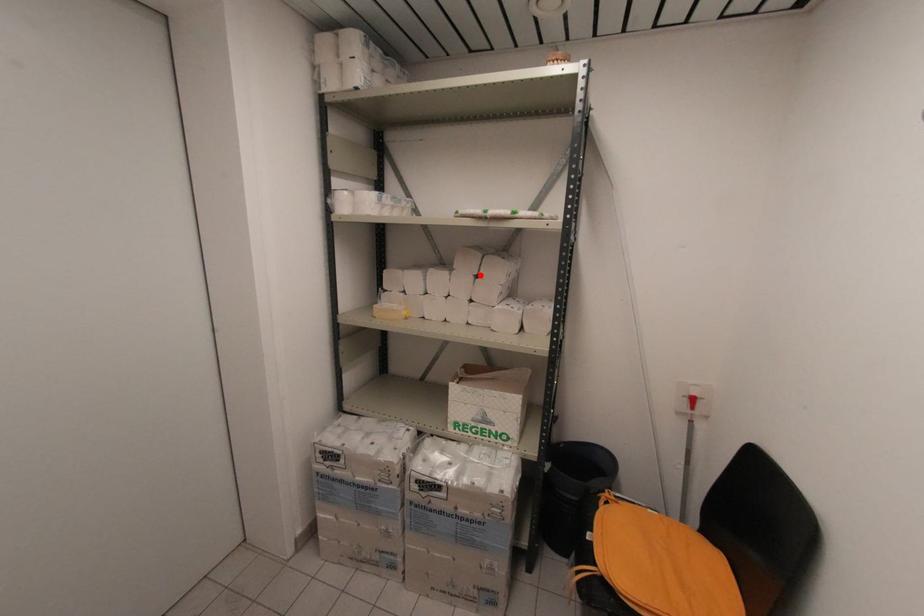
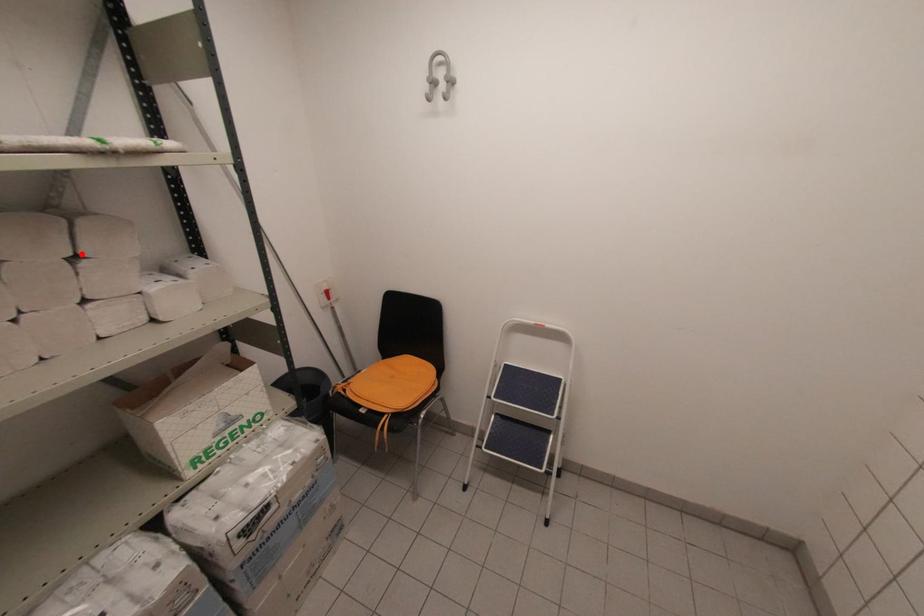
I am providing you with two images of the same scene from different viewpoints. A red point is marked on the first image and another point is marked on the second image. Is the marked point in image1 the same physical position as the marked point in image2?

Yes